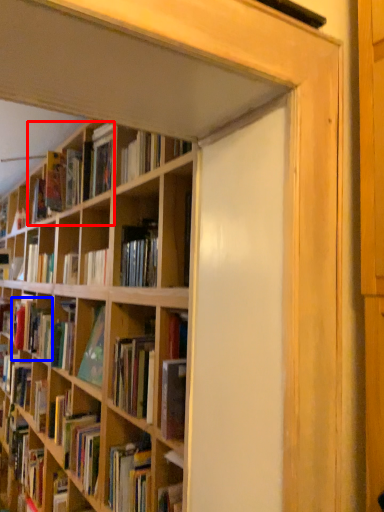
Question: Among these objects, which one is farthest to the camera, book (highlighted by a red box) or book (highlighted by a blue box)?

Choices:
 (A) book
 (B) book

Answer: (B)